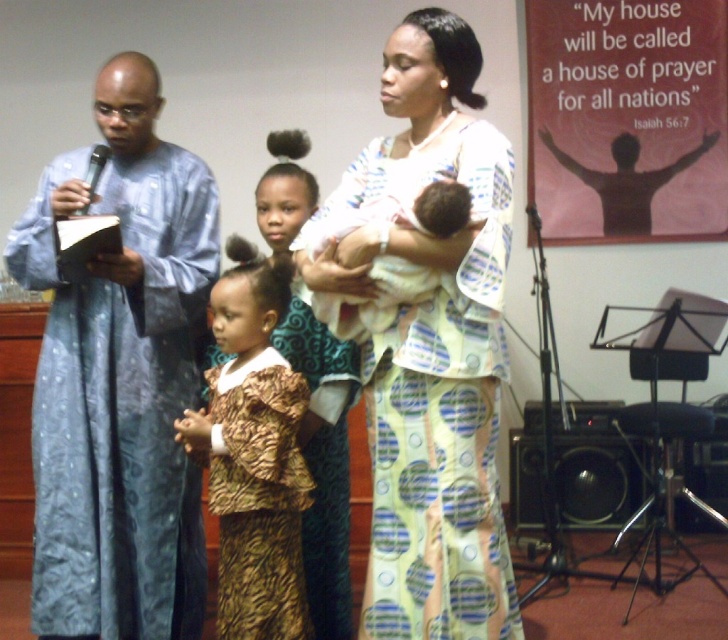
Between blue textured robe at left and brown textured dress at center, which one is positioned higher?

blue textured robe at left is above.

Does blue textured robe at left have a greater height compared to brown textured dress at center?

Correct, blue textured robe at left is much taller as brown textured dress at center.

Where is `blue textured robe at left`? The width and height of the screenshot is (728, 640). blue textured robe at left is located at coordinates (119, 378).

Who is higher up, light yellow printed dress at center or matte blue robe at left?

light yellow printed dress at center is higher up.

Can you confirm if light yellow printed dress at center is thinner than matte blue robe at left?

Incorrect, light yellow printed dress at center's width is not less than matte blue robe at left's.

Between point (490, 252) and point (482, 552), which one is positioned behind?

Positioned behind is point (482, 552).

This screenshot has height=640, width=728. I want to click on light yellow printed dress at center, so click(431, 349).

Measure the distance from light yellow printed dress at center to soft white baby at center.

The distance of light yellow printed dress at center from soft white baby at center is 6.20 inches.

Does light yellow printed dress at center have a greater height compared to soft white baby at center?

Correct, light yellow printed dress at center is much taller as soft white baby at center.

You are a GUI agent. You are given a task and a screenshot of the screen. Output one action in this format:
    pyautogui.click(x=<x>, y=<y>)
    Task: Click on the light yellow printed dress at center
    
    Given the screenshot: What is the action you would take?
    pyautogui.click(x=431, y=349)